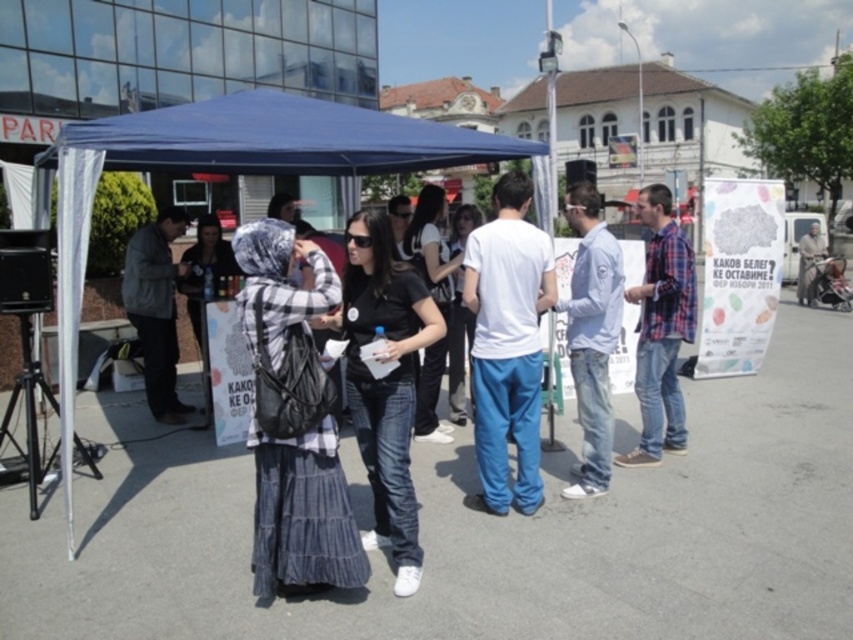
Question: Which object is positioned farthest from the light blue shirt at center?

Choices:
 (A) blue fabric canopy at upper left
 (B) plaid fabric headscarf at center

Answer: (B)

Question: Does light blue shirt at center have a lesser width compared to dark gray jacket at left?

Choices:
 (A) yes
 (B) no

Answer: (A)

Question: Is white cotton t-shirt at center closer to camera compared to dark gray jacket at left?

Choices:
 (A) no
 (B) yes

Answer: (B)

Question: Which point is farther to the camera?

Choices:
 (A) blue fabric tent at center
 (B) plaid fabric headscarf at center
 (C) plaid shirt at right
 (D) black matte shirt at center

Answer: (A)

Question: Considering the real-world distances, which object is closest to the dark gray jacket at left?

Choices:
 (A) blue fabric tent at center
 (B) plaid shirt at right
 (C) white cotton t-shirt at center

Answer: (A)

Question: Is the position of plaid shirt at right less distant than that of light brown fabric coat at lower right?

Choices:
 (A) yes
 (B) no

Answer: (A)